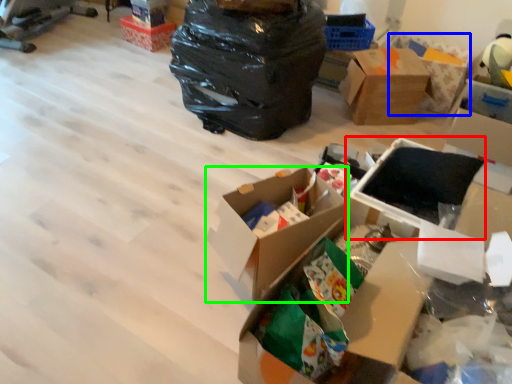
Question: Considering the real-world distances, which object is farthest from storage box (highlighted by a red box)? cardboard box (highlighted by a blue box) or box (highlighted by a green box)?

Choices:
 (A) cardboard box
 (B) box

Answer: (A)